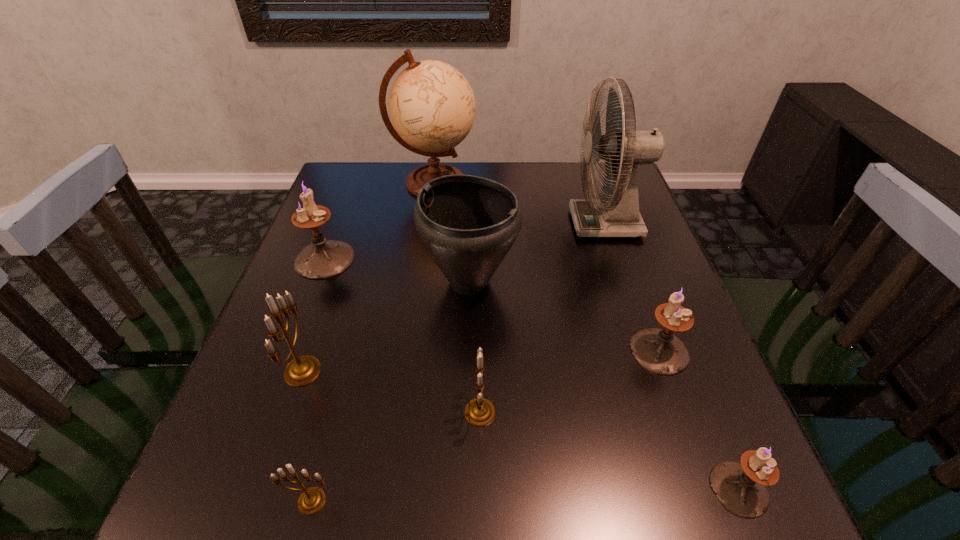
Where is `unoccupied area between the leftmost gold candelabrum and the gray fan`? The width and height of the screenshot is (960, 540). unoccupied area between the leftmost gold candelabrum and the gray fan is located at coordinates (454, 298).

Image resolution: width=960 pixels, height=540 pixels. I want to click on free spot between the biggest gold candelabrum and the beige globe, so click(369, 276).

The image size is (960, 540). In order to click on blank region between the nearest purple candle holder and the nearest gold candelabrum in this screenshot , I will do `click(525, 495)`.

Locate an element on the screen. object that is the third closest to the biggest gold candelabrum is located at coordinates (324, 258).

What are the coordinates of `object that is the second closest one to the globe` in the screenshot? It's located at (468, 224).

Locate an element on the screen. candle holder that is the sixth closest to the gray fan is located at coordinates (312, 499).

Identify the location of candle holder that is the fifth closest one to the smallest gold candelabrum. (740, 487).

Locate which purple candle holder is the second closest to the biggest purple candle holder. Please provide its 2D coordinates. Your answer should be formatted as a tuple, i.e. [(x, y)], where the tuple contains the x and y coordinates of a point satisfying the conditions above.

[(740, 487)]

Select which purple candle holder appears as the third closest to the fan. Please provide its 2D coordinates. Your answer should be formatted as a tuple, i.e. [(x, y)], where the tuple contains the x and y coordinates of a point satisfying the conditions above.

[(324, 258)]

The height and width of the screenshot is (540, 960). In order to click on gold candelabrum that is the closest to the rightmost gold candelabrum in this screenshot , I will do `click(312, 499)`.